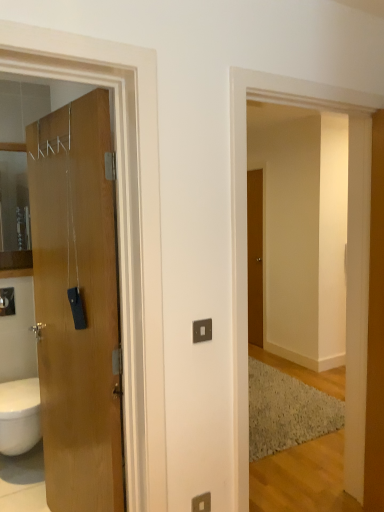
What do you see at coordinates (255, 256) in the screenshot?
I see `brown wooden door at center, the 2th door from the left` at bounding box center [255, 256].

Find the location of a particular element. This screenshot has height=512, width=384. wooden door at left, which is the 1th door in front-to-back order is located at coordinates (77, 304).

Describe the element at coordinates (357, 298) in the screenshot. Image resolution: width=384 pixels, height=512 pixels. I see `wooden pillar at right` at that location.

The image size is (384, 512). What are the coordinates of `brown wooden door at center, which appears as the first door when viewed from the right` in the screenshot? It's located at click(255, 256).

From the image's perspective, between brown wooden door at center, the second door positioned from the front, and matte silver switch at lower center, which one is located above?

From the image's view, brown wooden door at center, the second door positioned from the front, is above.

Which object is closer to the camera taking this photo, brown wooden door at center, which appears as the first door when viewed from the right, or matte silver switch at lower center?

matte silver switch at lower center is in front.

Visually, is brown wooden door at center, arranged as the first door when viewed from the back, positioned to the left or to the right of matte silver switch at lower center?

brown wooden door at center, arranged as the first door when viewed from the back, is to the right of matte silver switch at lower center.

Which is less distant, (209,510) or (254,224)?

Point (209,510) appears to be closer to the viewer than point (254,224).

From the image's perspective, who appears lower, matte silver switch at lower center or brown wooden door at center, arranged as the first door when viewed from the back?

matte silver switch at lower center.

Considering the sizes of matte silver switch at lower center and brown wooden door at center, arranged as the first door when viewed from the back, in the image, is matte silver switch at lower center taller or shorter than brown wooden door at center, arranged as the first door when viewed from the back,?

Clearly, matte silver switch at lower center is shorter compared to brown wooden door at center, arranged as the first door when viewed from the back.

Between brown wooden door at center, the 2th door from the left, and wooden pillar at right, which one appears on the right side from the viewer's perspective?

Positioned to the right is wooden pillar at right.

From a real-world perspective, is brown wooden door at center, which appears as the first door when viewed from the right, positioned under wooden pillar at right based on gravity?

No, from a real-world perspective, brown wooden door at center, which appears as the first door when viewed from the right, is not beneath wooden pillar at right.

From the image's perspective, which is below, brown wooden door at center, the 2th door from the left, or wooden pillar at right?

wooden pillar at right appears lower in the image.

Can we say brown wooden door at center, the second door positioned from the front, lies outside wooden pillar at right?

Yes, brown wooden door at center, the second door positioned from the front, is not within wooden pillar at right.

Is point (360, 397) positioned before point (120, 444)?

No, it is not.

Considering the relative sizes of wooden pillar at right and wooden door at left, arranged as the 1th door when viewed from the left, in the image provided, is wooden pillar at right taller than wooden door at left, arranged as the 1th door when viewed from the left,?

In fact, wooden pillar at right may be shorter than wooden door at left, arranged as the 1th door when viewed from the left.

Who is more distant, wooden pillar at right or wooden door at left, the 2th door positioned from the right?

wooden pillar at right is further away from the camera.

Is wooden pillar at right not near brown wooden door at center, which appears as the first door when viewed from the right?

Yes, wooden pillar at right and brown wooden door at center, which appears as the first door when viewed from the right, are quite far apart.

Considering the relative sizes of wooden pillar at right and brown wooden door at center, arranged as the first door when viewed from the back, in the image provided, is wooden pillar at right taller than brown wooden door at center, arranged as the first door when viewed from the back,?

Indeed, wooden pillar at right has a greater height compared to brown wooden door at center, arranged as the first door when viewed from the back.

From a real-world perspective, between wooden pillar at right and brown wooden door at center, which appears as the first door when viewed from the right, who is vertically higher?

From a 3D spatial view, brown wooden door at center, which appears as the first door when viewed from the right, is above.

Considering the relative positions of wooden pillar at right and brown wooden door at center, the second door positioned from the front, in the image provided, is wooden pillar at right to the left of brown wooden door at center, the second door positioned from the front, from the viewer's perspective?

No, wooden pillar at right is not to the left of brown wooden door at center, the second door positioned from the front.

Is matte silver switch at lower center outside of wooden pillar at right?

Yes, matte silver switch at lower center is located beyond the bounds of wooden pillar at right.

Is matte silver switch at lower center shorter than wooden pillar at right?

Yes.

Which is more to the left, matte silver switch at lower center or wooden pillar at right?

matte silver switch at lower center is more to the left.

What's the angular difference between matte silver switch at lower center and wooden pillar at right's facing directions?

118 degrees.

Does point (57, 394) come farther from viewer compared to point (203, 509)?

Yes, point (57, 394) is farther from viewer.

Is wooden door at left, marked as the second door in a back-to-front arrangement, at the left side of matte silver switch at lower center?

Indeed, wooden door at left, marked as the second door in a back-to-front arrangement, is positioned on the left side of matte silver switch at lower center.

Based on the photo, are wooden door at left, which is the 1th door in front-to-back order, and matte silver switch at lower center located far from each other?

wooden door at left, which is the 1th door in front-to-back order, is actually quite close to matte silver switch at lower center.

At what (x,y) coordinates should I click in order to perform the action: click on electric outlet in front of the brown wooden door at center, which appears as the first door when viewed from the right. Please return your answer as a coordinate pair (x, y). The width and height of the screenshot is (384, 512). Looking at the image, I should click on (201, 503).

Locate an element on the screen. This screenshot has height=512, width=384. electric outlet on the left of brown wooden door at center, the second door positioned from the front is located at coordinates (201, 503).

Which object lies nearer to the anchor point wooden pillar at right, wooden door at left, the 2th door positioned from the right, or matte silver switch at lower center?

matte silver switch at lower center is positioned closer to the anchor wooden pillar at right.

Which object lies further to the anchor point wooden door at left, the 2th door positioned from the right, wooden pillar at right or matte silver switch at lower center?

The object further to wooden door at left, the 2th door positioned from the right, is wooden pillar at right.

From the image, which object appears to be nearer to wooden pillar at right, matte silver switch at lower center or brown wooden door at center, arranged as the first door when viewed from the back?

Among the two, matte silver switch at lower center is located nearer to wooden pillar at right.

From the image, which object appears to be nearer to wooden door at left, arranged as the 1th door when viewed from the left, matte silver switch at lower center or wooden pillar at right?

matte silver switch at lower center is closer to wooden door at left, arranged as the 1th door when viewed from the left.

From the image, which object appears to be nearer to wooden pillar at right, matte silver switch at lower center or wooden door at left, which is the 1th door in front-to-back order?

matte silver switch at lower center is closer to wooden pillar at right.

Looking at the image, which one is located further to wooden door at left, arranged as the 1th door when viewed from the left, matte silver switch at lower center or brown wooden door at center, the 2th door from the left?

brown wooden door at center, the 2th door from the left.

Looking at this image, which object lies nearer to the anchor point matte silver switch at lower center, wooden pillar at right or wooden door at left, which is the 1th door in front-to-back order?

The object closer to matte silver switch at lower center is wooden door at left, which is the 1th door in front-to-back order.

Considering their positions, is wooden pillar at right positioned closer to brown wooden door at center, the second door positioned from the front, than matte silver switch at lower center?

wooden pillar at right.

Find the location of `electric outlet between wooden door at left, arranged as the 1th door when viewed from the left, and wooden pillar at right`. electric outlet between wooden door at left, arranged as the 1th door when viewed from the left, and wooden pillar at right is located at coordinates click(201, 503).

Find the location of a particular element. This screenshot has width=384, height=512. pillar located between matte silver switch at lower center and brown wooden door at center, the 2th door from the left, in the depth direction is located at coordinates (357, 298).

Where is `pillar between wooden door at left, the 2th door positioned from the right, and brown wooden door at center, arranged as the first door when viewed from the back, in the front-back direction`? The height and width of the screenshot is (512, 384). pillar between wooden door at left, the 2th door positioned from the right, and brown wooden door at center, arranged as the first door when viewed from the back, in the front-back direction is located at coordinates (357, 298).

What are the coordinates of `electric outlet between wooden door at left, which is the 1th door in front-to-back order, and brown wooden door at center, the second door positioned from the front, along the z-axis` in the screenshot? It's located at (201, 503).